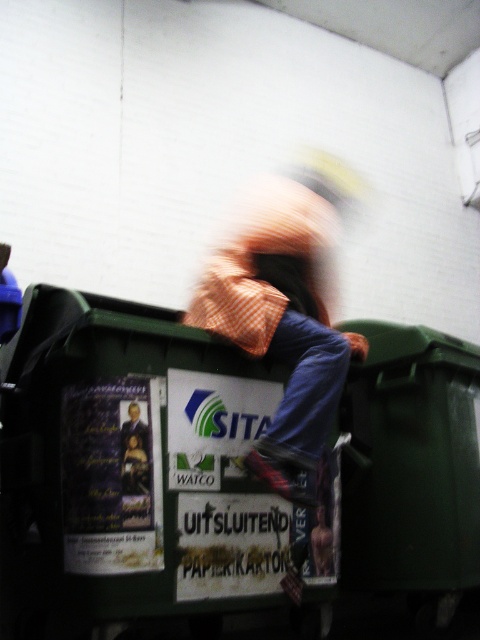
Between green plastic bin at center and orange checkered shirt at center, which one appears on the left side from the viewer's perspective?

green plastic bin at center is more to the left.

Which is more to the right, green plastic bin at center or orange checkered shirt at center?

Positioned to the right is orange checkered shirt at center.

Describe the element at coordinates (216, 474) in the screenshot. I see `green plastic bin at center` at that location.

The image size is (480, 640). What are the coordinates of `green plastic bin at center` in the screenshot? It's located at (216, 474).